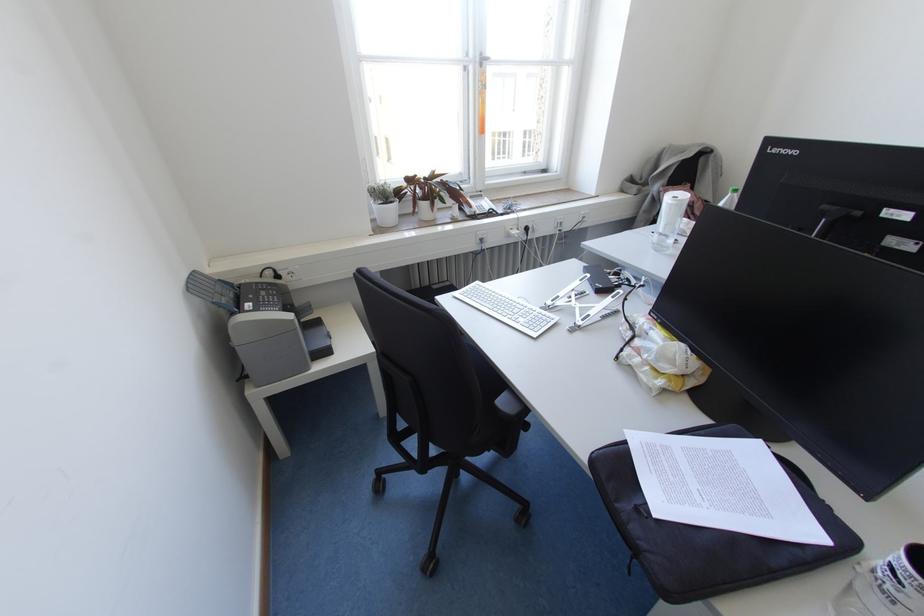
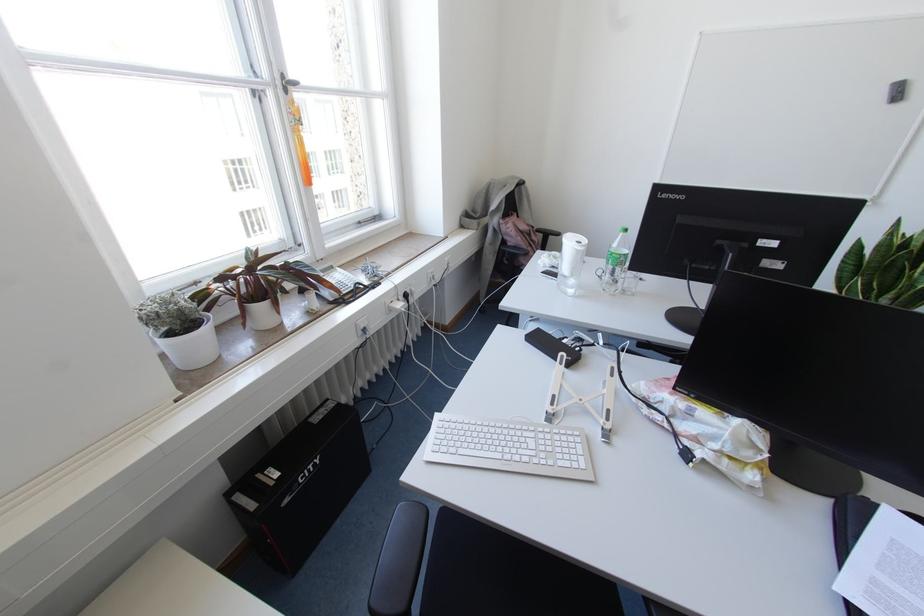
Locate, in the second image, the point that corresponds to the point at 484,198 in the first image.

(336, 268)